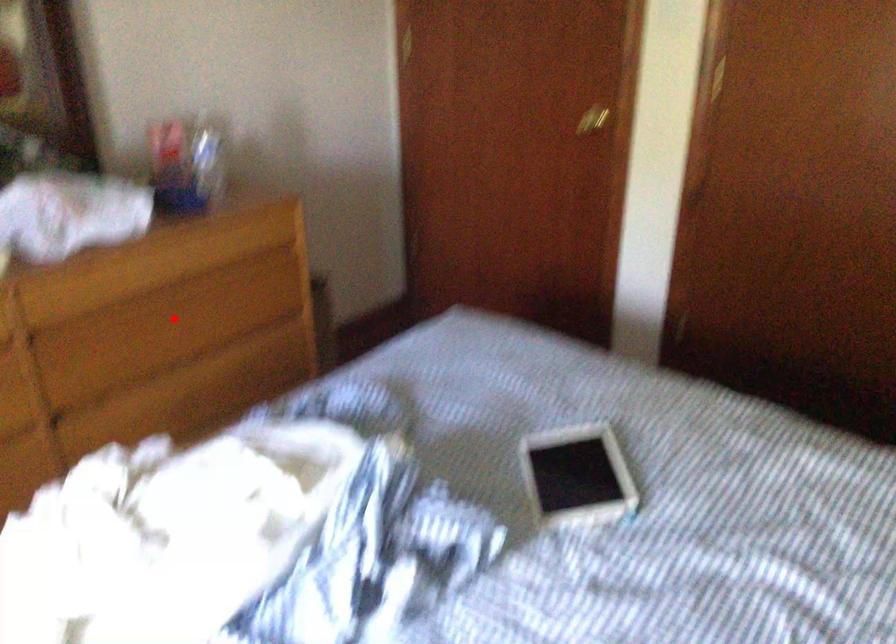
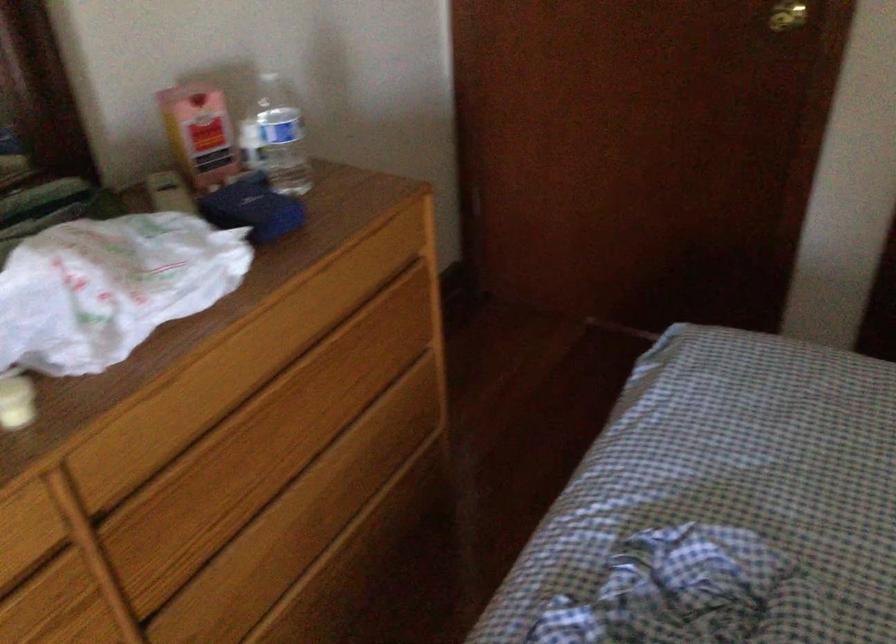
Question: I am providing you with two images of the same scene from different viewpoints. In image1, a red point is highlighted. Considering the same 3D point in image2, which of the following is correct?

Choices:
 (A) It is closer
 (B) It is farther

Answer: (A)